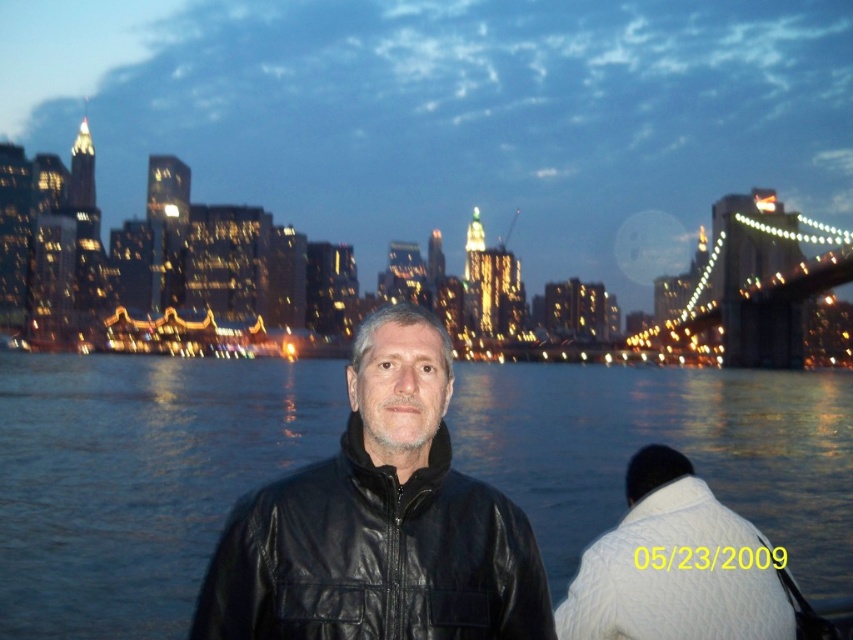
You are a photographer trying to capture the city lights reflected in the blue water at center. However, you notice the white knitted sweater at lower right might be blocking the reflection. Can you determine if the sweater is smaller than the water area to avoid obstruction?

The blue water at center has a larger size compared to white knitted sweater at lower right, so the sweater is smaller and less likely to obstruct the reflection of the city lights in the water.